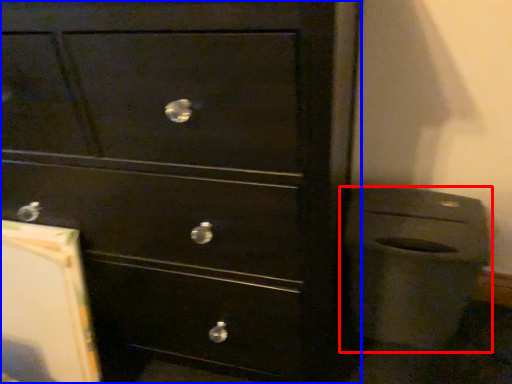
Question: Among these objects, which one is nearest to the camera, waste container (highlighted by a red box) or chest of drawers (highlighted by a blue box)?

Choices:
 (A) waste container
 (B) chest of drawers

Answer: (B)